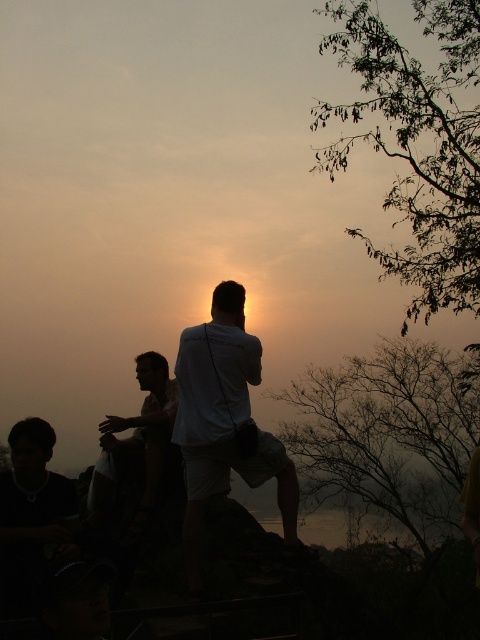
This screenshot has height=640, width=480. I want to click on white matte shirt at center, so click(225, 417).

Is white matte shirt at center above light brown fabric shirt at center?

Yes, white matte shirt at center is above light brown fabric shirt at center.

What are the coordinates of `white matte shirt at center` in the screenshot? It's located at (225, 417).

This screenshot has height=640, width=480. Identify the location of white matte shirt at center. (225, 417).